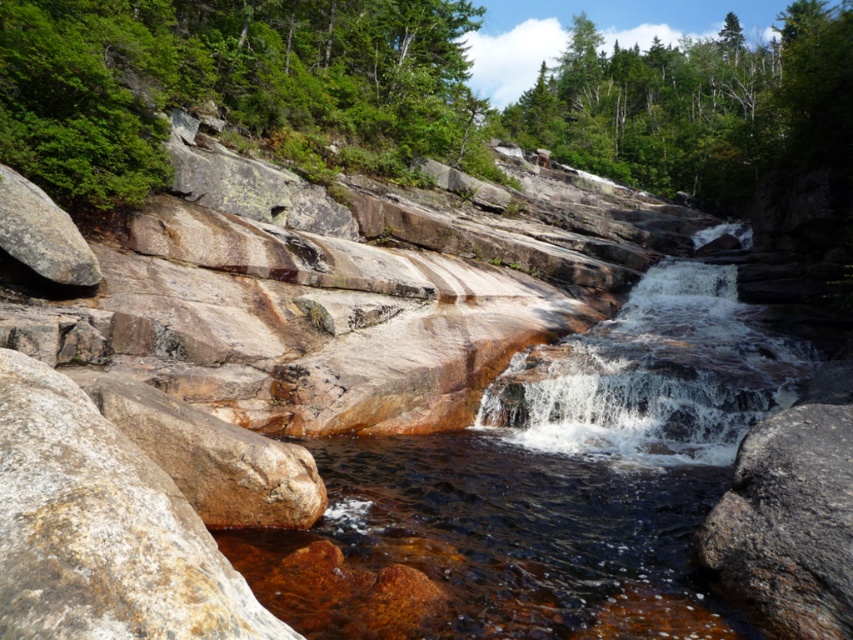
You are standing at the base of the waterfall and want to take a photo. There are two points marked in the scene, point 1 at coordinates point (239,602) and point 2 at coordinates point (529,376). Which point is closer to you?

Point (239,602) is closer to the camera than point (529,376), so the point closer to you is point (239,602).

You are standing at the origin point of the coordinate system in this waterfall scene. The rusty stone stream at center is located at a specific coordinate. Can you determine its exact coordinates?

The rusty stone stream at center is located at point (552, 481).

You are standing at the base of the waterfall and want to take a photo of the point at coordinates point [354,90]. Your camera has a maximum focus range of 30 meters. Will the camera be able to focus on the point?

The distance of point [354,90] from the camera is 35.81 meters, which exceeds the camera maximum focus range of 30 meters. Therefore, the camera will not be able to focus on the point.